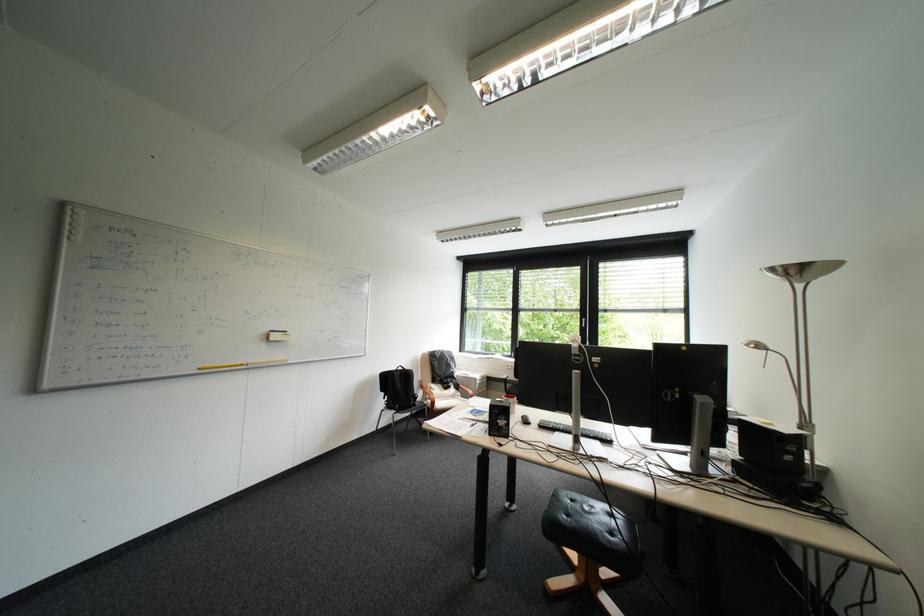
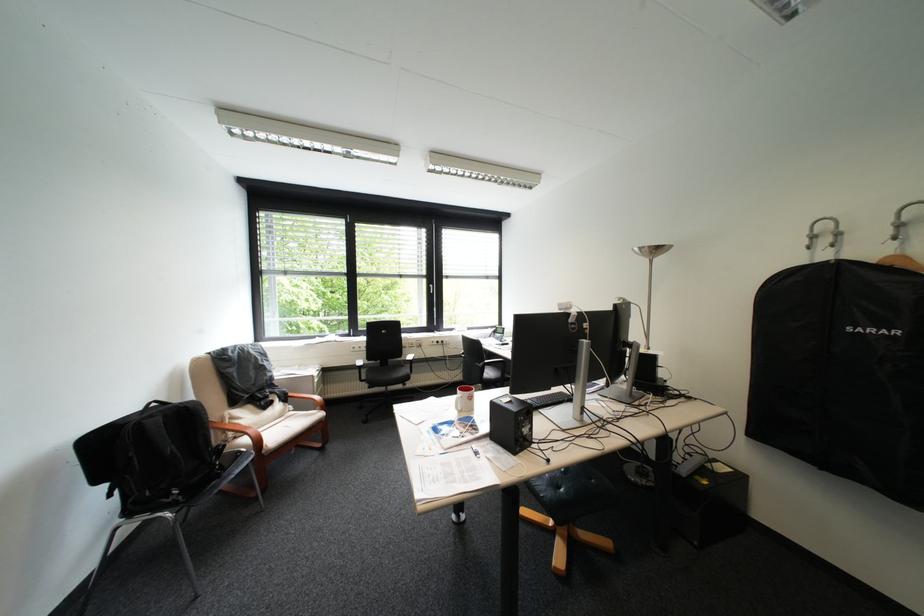
Locate, in the second image, the point that corresponds to point 429,395 in the first image.

(231, 445)